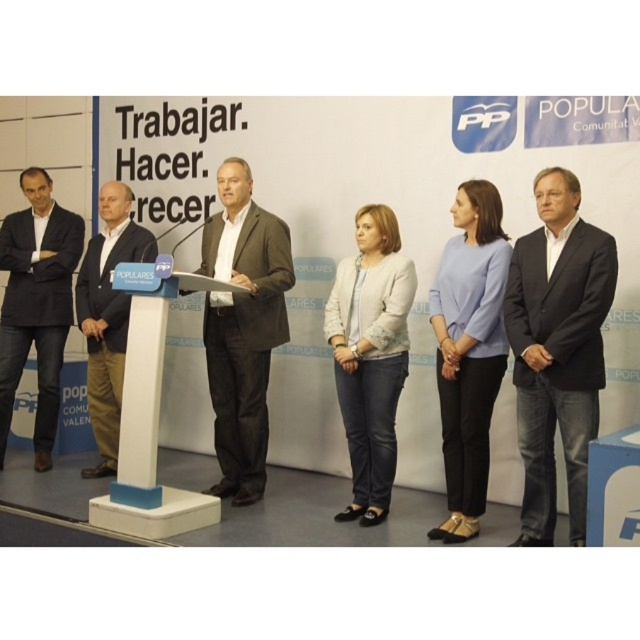
Question: Which of the following is the closest to the observer?

Choices:
 (A) (243, 209)
 (B) (337, 276)

Answer: (B)

Question: Is dark gray suit at center below light gray textured blazer at center?

Choices:
 (A) yes
 (B) no

Answer: (B)

Question: Considering the real-world distances, which object is farthest from the white plastic podium at center?

Choices:
 (A) dark gray suit at center
 (B) light brown leather jacket at center
 (C) dark gray suit at right

Answer: (C)

Question: Does dark gray suit at center appear under light blue fabric shirt at center?

Choices:
 (A) no
 (B) yes

Answer: (A)

Question: Which point is farther to the camera?

Choices:
 (A) (556, 403)
 (B) (3, 253)
 (C) (444, 269)

Answer: (B)

Question: Is dark gray suit at center below white plastic podium at center?

Choices:
 (A) yes
 (B) no

Answer: (B)